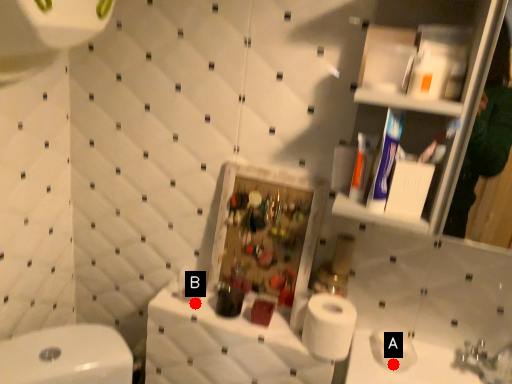
Question: Two points are circled on the image, labeled by A and B beside each circle. Which point is farther to the camera?

Choices:
 (A) A is further
 (B) B is further

Answer: (B)